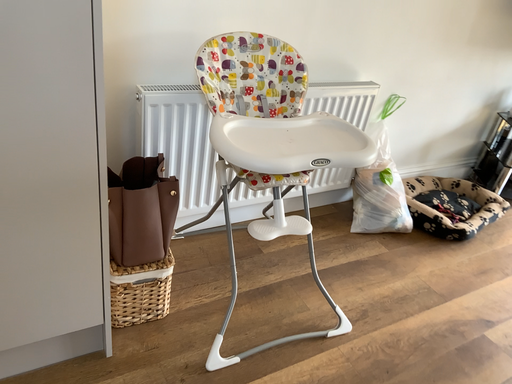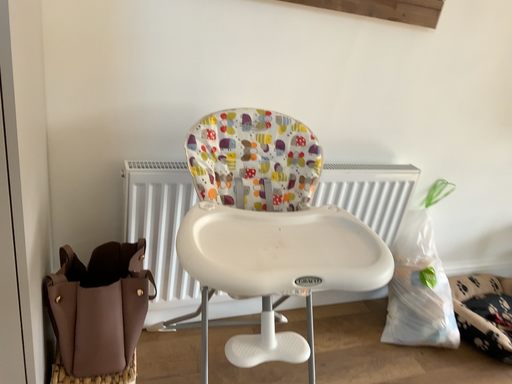
Question: Which way did the camera rotate in the video?

Choices:
 (A) rotated left
 (B) rotated right

Answer: (A)